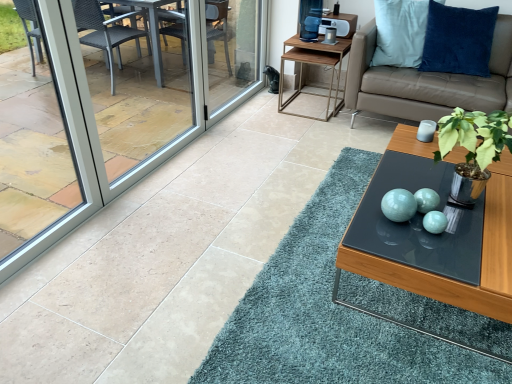
Identify the location of matte turquoise spheres at center. (399, 205).

In order to face matte turquoise spheres at center, should I rotate leftwards or rightwards?

To align with it, rotate right about 18.585°.

The image size is (512, 384). I want to click on matte glass coffee table at center, so (432, 272).

Image resolution: width=512 pixels, height=384 pixels. What do you see at coordinates (426, 81) in the screenshot?
I see `beige leather couch at upper right` at bounding box center [426, 81].

The width and height of the screenshot is (512, 384). What do you see at coordinates (314, 64) in the screenshot?
I see `wooden side table at upper right` at bounding box center [314, 64].

This screenshot has height=384, width=512. What do you see at coordinates (137, 84) in the screenshot?
I see `clear glass screen door at left, which is the second screen door from right to left` at bounding box center [137, 84].

What do you see at coordinates (458, 40) in the screenshot? I see `velvet blue pillow at upper right` at bounding box center [458, 40].

You are a GUI agent. You are given a task and a screenshot of the screen. Output one action in this format:
    pyautogui.click(x=<x>, y=<y>)
    Task: Click on the matte turquoise spheres at center
    
    Given the screenshot: What is the action you would take?
    [399, 205]

Is point (104, 21) closer to camera compared to point (375, 91)?

No, (104, 21) is further to viewer.

From the image's perspective, would you say clear glass screen door at left, which is the second screen door from right to left, is shown under beige leather couch at upper right?

Indeed, from the image's perspective, clear glass screen door at left, which is the second screen door from right to left, is shown beneath beige leather couch at upper right.

Is clear glass screen door at left, which is the second screen door from right to left, far from beige leather couch at upper right?

Yes, clear glass screen door at left, which is the second screen door from right to left, and beige leather couch at upper right are quite far apart.

Does clear glass screen door at left, which is counted as the 1th screen door, starting from the left, have a lesser height compared to beige leather couch at upper right?

No, clear glass screen door at left, which is counted as the 1th screen door, starting from the left, is not shorter than beige leather couch at upper right.

From the picture: In terms of height, does beige leather couch at upper right look taller or shorter compared to transparent glass window at left?

beige leather couch at upper right is shorter than transparent glass window at left.

Considering the positions of objects beige leather couch at upper right and transparent glass window at left in the image provided, who is more to the right, beige leather couch at upper right or transparent glass window at left?

Positioned to the right is beige leather couch at upper right.

Between beige leather couch at upper right and transparent glass window at left, which one has smaller width?

With smaller width is transparent glass window at left.

Does beige leather couch at upper right turn towards transparent glass window at left?

Yes.

Is clear glass screen door at left, which is the second screen door from right to left, at the back of beige leather couch at upper right?

No, clear glass screen door at left, which is the second screen door from right to left, is not at the back of beige leather couch at upper right.

Where is `the 2nd screen door positioned above the beige leather couch at upper right (from a real-world perspective)`? the 2nd screen door positioned above the beige leather couch at upper right (from a real-world perspective) is located at coordinates (137, 84).

Considering the sizes of objects beige leather couch at upper right and clear glass screen door at left, which is counted as the 1th screen door, starting from the left, in the image provided, who is wider, beige leather couch at upper right or clear glass screen door at left, which is counted as the 1th screen door, starting from the left,?

beige leather couch at upper right is wider.

Looking at this image, are clear glass screen door at center, the second screen door viewed from the left, and matte turquoise spheres at center making contact?

No, clear glass screen door at center, the second screen door viewed from the left, is not with matte turquoise spheres at center.

Can you confirm if clear glass screen door at center, the second screen door viewed from the left, is shorter than matte turquoise spheres at center?

No, clear glass screen door at center, the second screen door viewed from the left, is not shorter than matte turquoise spheres at center.

From the image's perspective, is clear glass screen door at center, arranged as the 1th screen door when viewed from the right, located beneath matte turquoise spheres at center?

Incorrect, from the image's perspective, clear glass screen door at center, arranged as the 1th screen door when viewed from the right, is higher than matte turquoise spheres at center.

Identify the location of screen door that is in front of the clear glass screen door at center, the second screen door viewed from the left. This screenshot has height=384, width=512. (137, 84).

Is clear glass screen door at center, arranged as the 1th screen door when viewed from the right, positioned with its back to clear glass screen door at left, which is the second screen door from right to left?

No, clear glass screen door at center, arranged as the 1th screen door when viewed from the right, is not facing the opposite direction of clear glass screen door at left, which is the second screen door from right to left.

From a real-world perspective, is clear glass screen door at center, arranged as the 1th screen door when viewed from the right, beneath clear glass screen door at left, which is counted as the 1th screen door, starting from the left?

Yes, from a real-world perspective, clear glass screen door at center, arranged as the 1th screen door when viewed from the right, is below clear glass screen door at left, which is counted as the 1th screen door, starting from the left.

Would you say clear glass screen door at center, the second screen door viewed from the left, contains clear glass screen door at left, which is the second screen door from right to left?

No, clear glass screen door at left, which is the second screen door from right to left, is not surrounded by clear glass screen door at center, the second screen door viewed from the left.

Could you tell me if transparent glass window at left is facing velvet blue pillow at upper right?

No, transparent glass window at left is not turned towards velvet blue pillow at upper right.

Are transparent glass window at left and velvet blue pillow at upper right located far from each other?

Yes, transparent glass window at left and velvet blue pillow at upper right are located far from each other.

Is velvet blue pillow at upper right completely or partially inside transparent glass window at left?

Definitely not — velvet blue pillow at upper right is not inside transparent glass window at left.

Is transparent glass window at left at the left side of velvet blue pillow at upper right?

Yes, transparent glass window at left is to the left of velvet blue pillow at upper right.

Is wooden side table at upper right not inside green leafy plant in metallic pot at center-right?

Yes, wooden side table at upper right is outside of green leafy plant in metallic pot at center-right.

Between wooden side table at upper right and green leafy plant in metallic pot at center-right, which one has larger width?

wooden side table at upper right.

Considering the sizes of objects wooden side table at upper right and green leafy plant in metallic pot at center-right in the image provided, who is smaller, wooden side table at upper right or green leafy plant in metallic pot at center-right?

With smaller size is green leafy plant in metallic pot at center-right.

Is wooden side table at upper right far from green leafy plant in metallic pot at center-right?

Yes.

Where is `the 2nd screen door to the left of the beige leather couch at upper right, counting from the anchor's position`? The width and height of the screenshot is (512, 384). the 2nd screen door to the left of the beige leather couch at upper right, counting from the anchor's position is located at coordinates (137, 84).

Where is `window screen above the beige leather couch at upper right (from a real-world perspective)`? The image size is (512, 384). window screen above the beige leather couch at upper right (from a real-world perspective) is located at coordinates (69, 141).

Based on the photo, when comparing their distances from wooden side table at upper right, does green leafy plant in metallic pot at center-right or beige leather couch at upper right seem closer?

beige leather couch at upper right.

Looking at the image, which one is located closer to transparent glass window at left, beige leather couch at upper right or clear glass screen door at left, which is the second screen door from right to left?

beige leather couch at upper right.

Consider the image. Based on their spatial positions, is wooden side table at upper right or matte glass coffee table at center closer to clear glass screen door at left, which is counted as the 1th screen door, starting from the left?

The object closer to clear glass screen door at left, which is counted as the 1th screen door, starting from the left, is wooden side table at upper right.

Looking at the image, which one is located closer to clear glass screen door at center, the second screen door viewed from the left, transparent glass window at left or matte turquoise spheres at center?

Among the two, transparent glass window at left is located nearer to clear glass screen door at center, the second screen door viewed from the left.

Considering their positions, is transparent glass window at left positioned further to clear glass screen door at left, which is counted as the 1th screen door, starting from the left, than matte turquoise spheres at center?

matte turquoise spheres at center.

Estimate the real-world distances between objects in this image. Which object is closer to clear glass screen door at left, which is counted as the 1th screen door, starting from the left, matte turquoise spheres at center or velvet blue pillow at upper right?

The object closer to clear glass screen door at left, which is counted as the 1th screen door, starting from the left, is velvet blue pillow at upper right.

Which object lies nearer to the anchor point beige leather couch at upper right, wooden side table at upper right or matte turquoise spheres at center?

wooden side table at upper right is positioned closer to the anchor beige leather couch at upper right.

In the scene shown: Looking at the image, which one is located closer to transparent glass window at left, clear glass screen door at left, which is the second screen door from right to left, or matte glass coffee table at center?

matte glass coffee table at center.

The height and width of the screenshot is (384, 512). Identify the location of studio couch located between clear glass screen door at left, which is counted as the 1th screen door, starting from the left, and velvet blue pillow at upper right in the left-right direction. (426, 81).

This screenshot has width=512, height=384. I want to click on turquoise between green leafy plant in metallic pot at center-right and wooden side table at upper right in the front-back direction, so click(399, 205).

The width and height of the screenshot is (512, 384). What are the coordinates of `houseplant situated between clear glass screen door at left, which is counted as the 1th screen door, starting from the left, and beige leather couch at upper right from left to right` in the screenshot? It's located at (473, 149).

What are the coordinates of `table between clear glass screen door at center, arranged as the 1th screen door when viewed from the right, and velvet blue pillow at upper right, in the horizontal direction` in the screenshot? It's located at (314, 64).